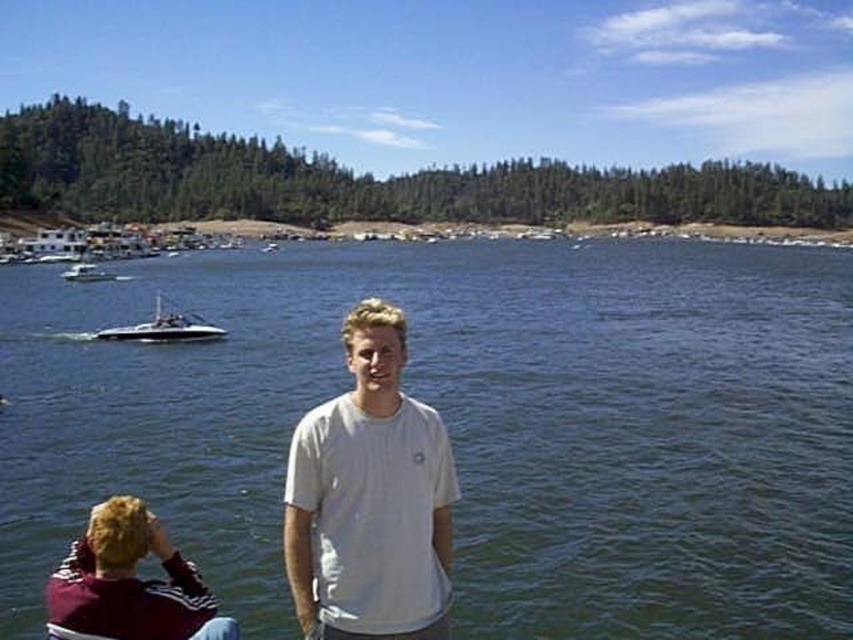
Question: Estimate the real-world distances between objects in this image. Which object is farther from the shiny white speedboat at center?

Choices:
 (A) maroon fabric shirt at lower left
 (B) white cotton t-shirt at center
 (C) white glossy boat at left
 (D) clear water at center

Answer: (A)

Question: Among these objects, which one is farthest from the camera?

Choices:
 (A) shiny white speedboat at center
 (B) white glossy boat at left
 (C) white cotton t-shirt at center

Answer: (B)

Question: Which object is the farthest from the clear water at center?

Choices:
 (A) white glossy boat at center
 (B) maroon fabric shirt at lower left
 (C) white glossy boat at left

Answer: (A)

Question: From the image, what is the correct spatial relationship of white cotton t-shirt at center in relation to shiny white speedboat at center?

Choices:
 (A) below
 (B) above

Answer: (A)

Question: Does white cotton t-shirt at center appear on the left side of white glossy boat at left?

Choices:
 (A) no
 (B) yes

Answer: (A)

Question: Observing the image, what is the correct spatial positioning of white cotton t-shirt at center in reference to white glossy boat at left?

Choices:
 (A) above
 (B) below

Answer: (B)